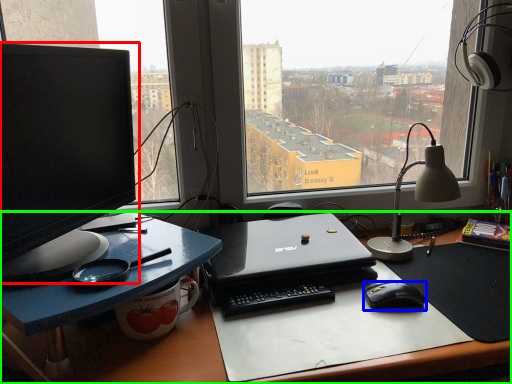
Question: Estimate the real-world distances between objects in this image. Which object is closer to computer monitor (highlighted by a red box), mouse (highlighted by a blue box) or desk (highlighted by a green box)?

Choices:
 (A) mouse
 (B) desk

Answer: (B)